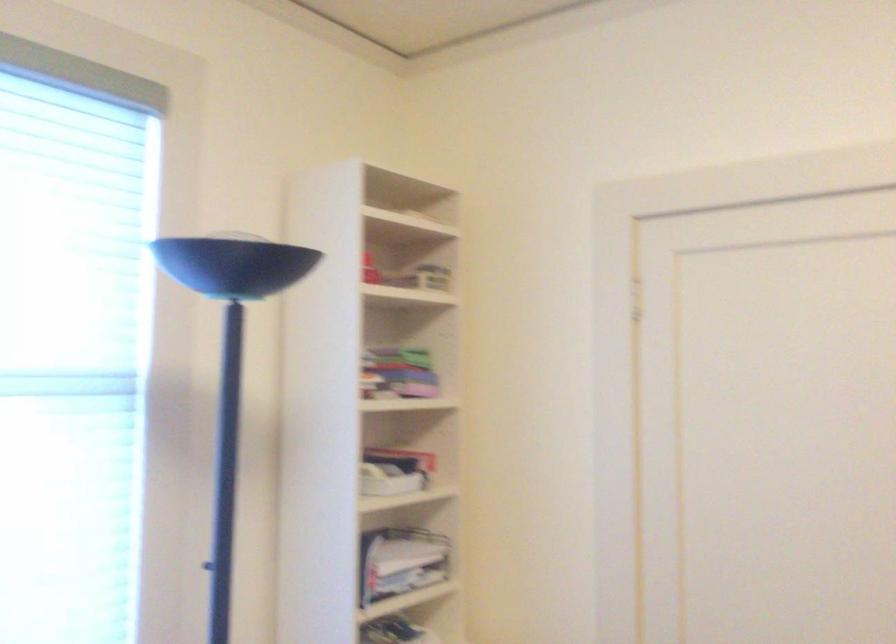
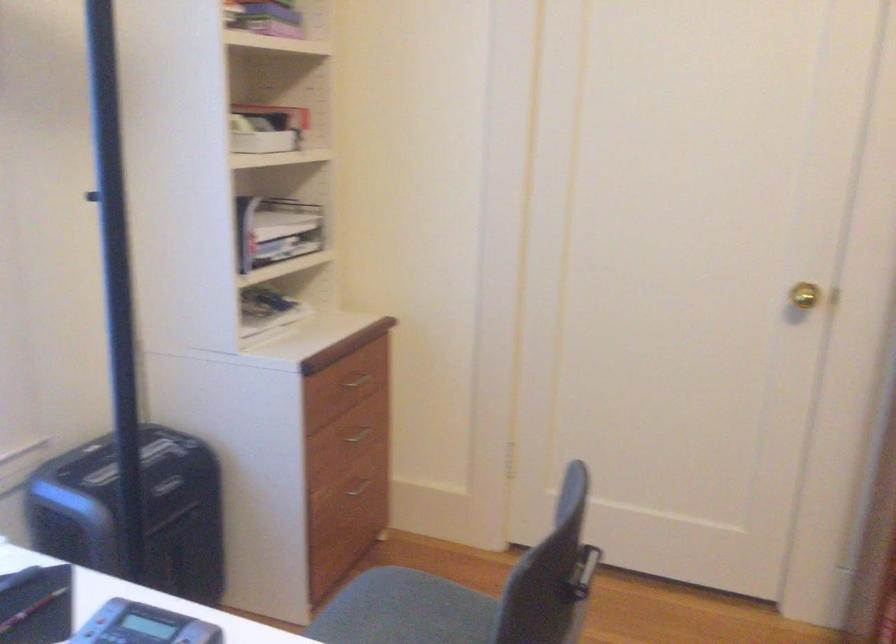
Question: In a continuous first-person perspective shot, in which direction is the camera moving?

Choices:
 (A) Left
 (B) Right
 (C) Forward
 (D) Backward

Answer: (C)